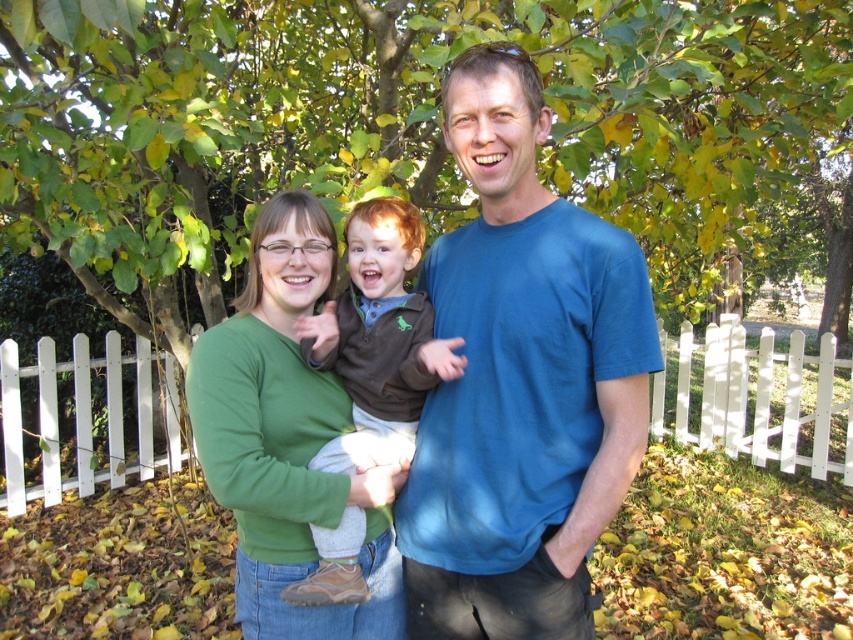
This screenshot has height=640, width=853. Identify the location of white picket fence at center. (756, 397).

The height and width of the screenshot is (640, 853). What are the coordinates of `white picket fence at center` in the screenshot? It's located at (756, 397).

Identify the location of white picket fence at center. (756, 397).

Is blue cotton t-shirt at center positioned in front of green matte sweater at center?

That is True.

Is point (556, 416) farther from camera compared to point (212, 422)?

No, (556, 416) is closer to viewer.

Locate an element on the screen. This screenshot has height=640, width=853. blue cotton t-shirt at center is located at coordinates (521, 381).

Does green matte sweater at center have a lesser height compared to brown suede boot at center?

In fact, green matte sweater at center may be taller than brown suede boot at center.

Can you confirm if green matte sweater at center is positioned to the right of brown suede boot at center?

In fact, green matte sweater at center is to the left of brown suede boot at center.

The height and width of the screenshot is (640, 853). I want to click on green matte sweater at center, so click(x=287, y=436).

Locate an element on the screen. green matte sweater at center is located at coordinates (287, 436).